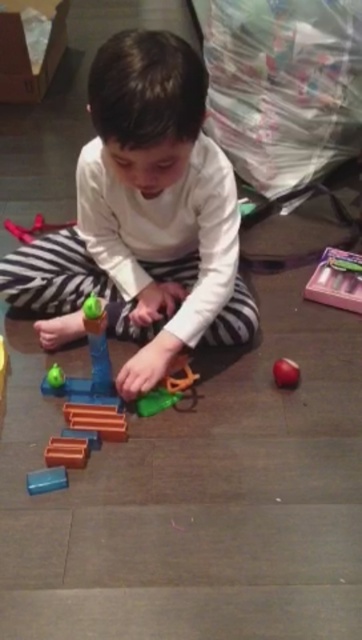
Does white matte shirt at center appear over translucent orange toy at center?

Correct, white matte shirt at center is located above translucent orange toy at center.

Which is below, white matte shirt at center or translucent orange toy at center?

translucent orange toy at center

Which is in front, point (236, 305) or point (191, 381)?

Point (191, 381) is in front.

Identify the location of white matte shirt at center. (x=148, y=216).

Is blue plastic blocks at center positioned at the back of translucent blue block at lower left?

No, blue plastic blocks at center is closer to the viewer.

Can you confirm if blue plastic blocks at center is positioned below translucent blue block at lower left?

No, blue plastic blocks at center is not below translucent blue block at lower left.

Between point (104, 362) and point (28, 481), which one is positioned in front?

Point (28, 481) is in front.

Locate an element on the screen. The width and height of the screenshot is (362, 640). blue plastic blocks at center is located at coordinates click(x=86, y=396).

Which is behind, point (358, 268) or point (284, 378)?

Point (358, 268)

Is pink plastic toy at upper right to the right of shiny red apple at lower right from the viewer's perspective?

Indeed, pink plastic toy at upper right is positioned on the right side of shiny red apple at lower right.

Describe the element at coordinates (335, 282) in the screenshot. Image resolution: width=362 pixels, height=640 pixels. I see `pink plastic toy at upper right` at that location.

You are a GUI agent. You are given a task and a screenshot of the screen. Output one action in this format:
    pyautogui.click(x=<x>, y=<y>)
    Task: Click on the pink plastic toy at upper right
    
    Given the screenshot: What is the action you would take?
    pyautogui.click(x=335, y=282)